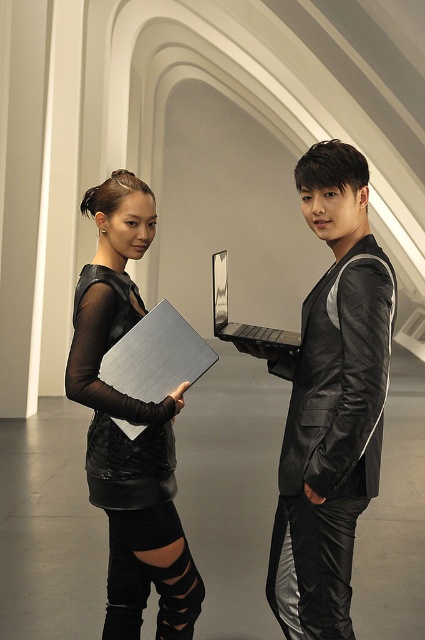
You are standing in the room and want to place a new decorative item on the floor. The metallic silver laptop at center is located at point (x=331, y=401). If you want to place the new item 0.3 units to the left of the laptop, what coordinate would that be?

The new item should be placed at coordinate 0.628 minus 0.3 equals 0.328, so the coordinate is 0.328, 0.779.

You are a fashion designer observing the two dresses displayed in the image. The matte black dress at center and the black leather dress at left are both part of your collection. Which dress is taller in height?

The matte black dress at center has a greater height compared to the black leather dress at left.

From the picture: You are a fashion designer observing two outfits in a minimalist interior space. You need to decide which outfit is shorter between the black leather jacket at center and the matte black dress at center. Which one is shorter?

The black leather jacket at center is shorter than the matte black dress at center.